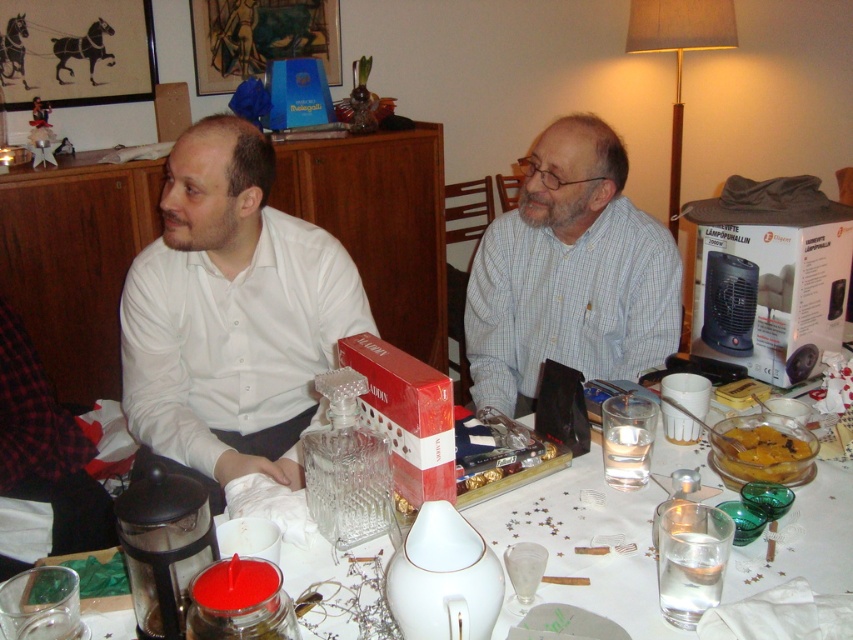
Which is behind, point (265, 376) or point (502, 504)?

Positioned behind is point (265, 376).

Is white matte shirt at left positioned at the back of white ceramic vase at center?

Yes, it is.

Is point (299, 400) positioned in front of point (534, 467)?

No, (299, 400) is behind (534, 467).

At what (x,y) coordinates should I click in order to perform the action: click on white matte shirt at left. Please return your answer as a coordinate pair (x, y). The height and width of the screenshot is (640, 853). Looking at the image, I should click on (230, 316).

Is white matte shirt at left below yellow matte dessert at center?

Actually, white matte shirt at left is above yellow matte dessert at center.

Is white matte shirt at left thinner than yellow matte dessert at center?

Incorrect, white matte shirt at left's width is not less than yellow matte dessert at center's.

This screenshot has width=853, height=640. What do you see at coordinates (230, 316) in the screenshot?
I see `white matte shirt at left` at bounding box center [230, 316].

You are a GUI agent. You are given a task and a screenshot of the screen. Output one action in this format:
    pyautogui.click(x=<x>, y=<y>)
    Task: Click on the white matte shirt at left
    Image resolution: width=853 pixels, height=640 pixels.
    Given the screenshot: What is the action you would take?
    pyautogui.click(x=230, y=316)

Is point (808, 522) positioned behind point (730, 474)?

No, (808, 522) is in front of (730, 474).

Which of these two, white ceramic vase at center or yellow matte dessert at center, stands shorter?

yellow matte dessert at center

Between point (837, 470) and point (799, 433), which one is positioned in front?

Positioned in front is point (837, 470).

At what (x,y) coordinates should I click in order to perform the action: click on white ceramic vase at center. Please return your answer as a coordinate pair (x, y). This screenshot has width=853, height=640. Looking at the image, I should click on (585, 541).